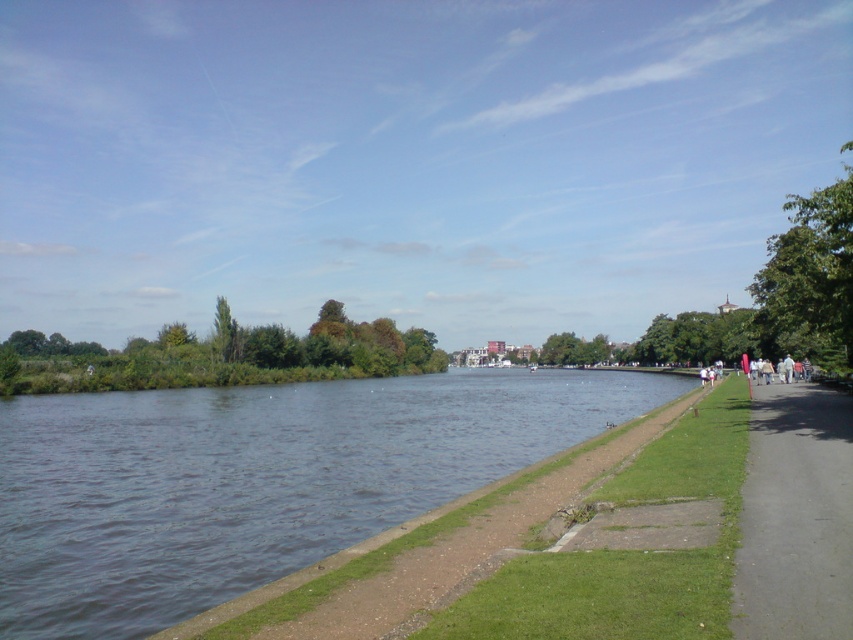
Who is positioned more to the left, dark blue water at center or green leafy tree at center?

green leafy tree at center is more to the left.

Which is below, dark blue water at center or green leafy tree at center?

dark blue water at center

Does point (556, 428) come in front of point (225, 317)?

Yes, it is.

Where is `dark blue water at center`? The width and height of the screenshot is (853, 640). dark blue water at center is located at coordinates (254, 481).

Is green leafy tree at upper right closer to camera compared to green leafy tree at upper left?

Yes.

In the scene shown: Does green leafy tree at upper right have a lesser height compared to green leafy tree at upper left?

No, green leafy tree at upper right is not shorter than green leafy tree at upper left.

Who is more forward, (x=833, y=310) or (x=175, y=344)?

Point (x=833, y=310) is more forward.

This screenshot has height=640, width=853. Find the location of `green leafy tree at upper right`. green leafy tree at upper right is located at coordinates (810, 276).

Which is more to the left, black asphalt path at right or green leafy tree at center?

green leafy tree at center is more to the left.

Who is shorter, black asphalt path at right or green leafy tree at center?

black asphalt path at right

Is point (822, 509) behind point (222, 330)?

No.

Find the location of a particular element. This screenshot has height=640, width=853. black asphalt path at right is located at coordinates (795, 516).